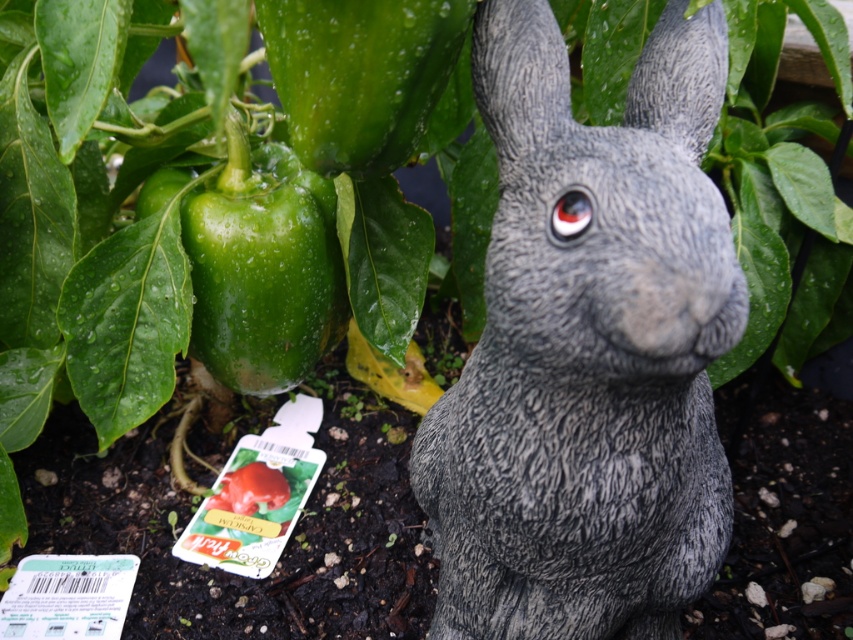
Based on the photo, you are a gardener who wants to water both the gray stone rabbit at center and the green matte bell pepper at left. Since you can only water one at a time, which one should you water first if you want to reach the one farther from the water source located at the far left corner?

The gray stone rabbit at center is to the right of the green matte bell pepper at left, so the green matte bell pepper at left is closer to the water source at the far left corner. Therefore, you should water the gray stone rabbit at center first because it is farther away and needs to be watered before the closer one to ensure it gets enough water before moving closer.

In the scene shown: You are a gardener who wants to water both the gray stone rabbit at center and the green matte bell pepper at upper left. Since the rabbit is under the pepper, will you water the bell pepper first or the rabbit first?

You should water the green matte bell pepper at upper left first because the gray stone rabbit at center is positioned under it, so water will drip down from the bell pepper onto the rabbit.

You are a gardener looking at the garden scene. You see the green matte bell pepper at left and the green matte bell pepper at upper left. Which one is positioned lower in the image?

The green matte bell pepper at left is located below the green matte bell pepper at upper left, so it is positioned lower in the image.